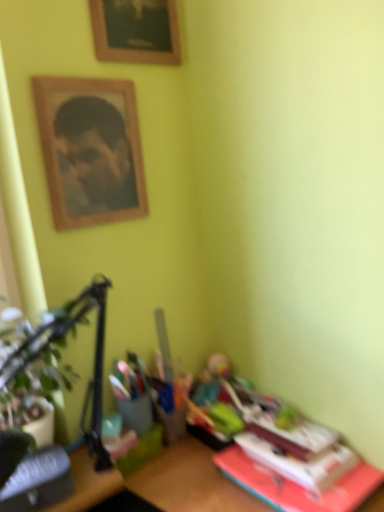
Question: Is the depth of hardcover book at lower left, which appears as the first paperback book when viewed from the left, less than that of green leafy plant at left?

Choices:
 (A) no
 (B) yes

Answer: (A)

Question: Does hardcover book at lower left, positioned as the 2th paperback book in right-to-left order, have a greater height compared to green leafy plant at left?

Choices:
 (A) no
 (B) yes

Answer: (A)

Question: Does hardcover book at lower left, which appears as the first paperback book when viewed from the left, have a lesser height compared to green leafy plant at left?

Choices:
 (A) no
 (B) yes

Answer: (B)

Question: Does hardcover book at lower left, which appears as the first paperback book when viewed from the left, have a smaller size compared to green leafy plant at left?

Choices:
 (A) no
 (B) yes

Answer: (B)

Question: From a real-world perspective, is hardcover book at lower left, positioned as the 2th paperback book in right-to-left order, physically below green leafy plant at left?

Choices:
 (A) yes
 (B) no

Answer: (A)

Question: Is there a large distance between hardcover book at lower left, positioned as the 2th paperback book in right-to-left order, and green leafy plant at left?

Choices:
 (A) yes
 (B) no

Answer: (B)

Question: From a real-world perspective, is wooden framed portrait at upper left below hardcover book at lower right, which is counted as the second paperback book, starting from the left?

Choices:
 (A) yes
 (B) no

Answer: (B)

Question: Can you confirm if wooden framed portrait at upper left is smaller than hardcover book at lower right, the first paperback book in the right-to-left sequence?

Choices:
 (A) no
 (B) yes

Answer: (A)

Question: Is wooden framed portrait at upper left shorter than hardcover book at lower right, which is counted as the second paperback book, starting from the left?

Choices:
 (A) yes
 (B) no

Answer: (B)

Question: Is wooden framed portrait at upper left bigger than hardcover book at lower right, the first paperback book in the right-to-left sequence?

Choices:
 (A) no
 (B) yes

Answer: (B)

Question: Would you say wooden framed portrait at upper left is outside hardcover book at lower right, which is counted as the second paperback book, starting from the left?

Choices:
 (A) yes
 (B) no

Answer: (A)

Question: Is wooden framed portrait at upper left facing towards hardcover book at lower right, which is counted as the second paperback book, starting from the left?

Choices:
 (A) no
 (B) yes

Answer: (A)

Question: Can you confirm if green leafy plant at left is bigger than wooden picture frame at upper center?

Choices:
 (A) yes
 (B) no

Answer: (A)